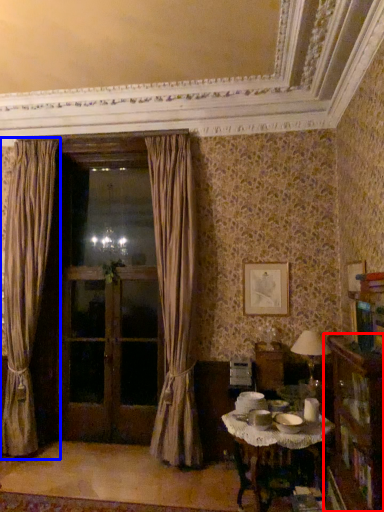
Question: Among these objects, which one is farthest to the camera, bookcase (highlighted by a red box) or curtain (highlighted by a blue box)?

Choices:
 (A) bookcase
 (B) curtain

Answer: (B)